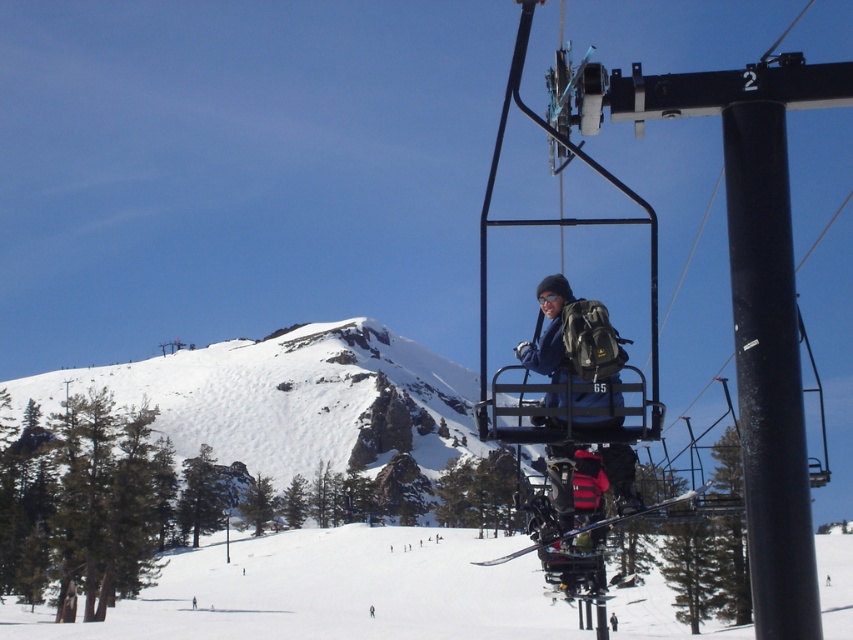
From the picture: You are a skier planning to take the ski lift to the top of the mountain. You see the white snow ski slope at center and the black matte pole at center right. Which object is located above the other?

The black matte pole at center right is above the white snow ski slope at center because the white snow ski slope at center is positioned under it.

You are planning to install a new flagpole at the ski resort. The flagpole needs to be taller than the existing metallic blue ski lift at upper right. Based on the scene, is the black matte pole at center right a suitable candidate for this purpose? Please explain your reasoning.

The metallic blue ski lift at upper right is much taller than the black matte pole at center right. Since the flagpole needs to be taller than the metallic blue ski lift at upper right, the black matte pole at center right is not a suitable candidate because it is shorter than the required height.